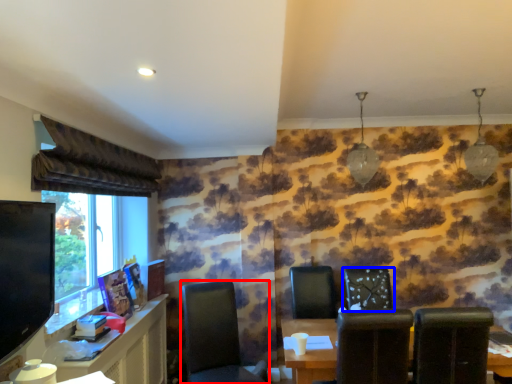
Question: Which object appears farthest to the camera in this image, chair (highlighted by a red box) or chair (highlighted by a blue box)?

Choices:
 (A) chair
 (B) chair

Answer: (B)